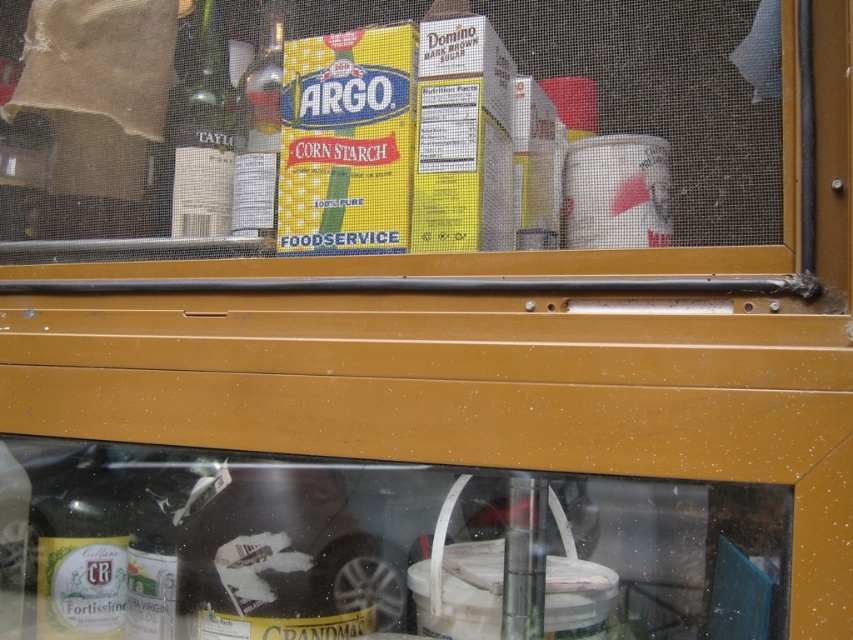
Can you confirm if yellow cardboard box at center is wider than green glass bottle at left?

Yes.

Consider the image. Which of these two, yellow cardboard box at center or green glass bottle at left, stands taller?

Standing taller between the two is yellow cardboard box at center.

I want to click on yellow cardboard box at center, so click(437, 147).

Can you confirm if yellow cardboard box at center is shorter than metallic silver bottle at upper left?

Incorrect, yellow cardboard box at center's height does not fall short of metallic silver bottle at upper left's.

Who is positioned more to the right, yellow cardboard box at center or metallic silver bottle at upper left?

Positioned to the right is yellow cardboard box at center.

Between point (276, 154) and point (264, 100), which one is positioned behind?

The point (264, 100) is behind.

Locate an element on the screen. This screenshot has width=853, height=640. yellow cardboard box at center is located at coordinates (437, 147).

Measure the distance between green glass bottle at left and camera.

green glass bottle at left is 4.03 feet from camera.

Is green glass bottle at left smaller than metallic silver bottle at upper left?

Indeed, green glass bottle at left has a smaller size compared to metallic silver bottle at upper left.

Does point (221, 154) come in front of point (270, 216)?

No, it is not.

Locate an element on the screen. This screenshot has width=853, height=640. green glass bottle at left is located at coordinates (204, 129).